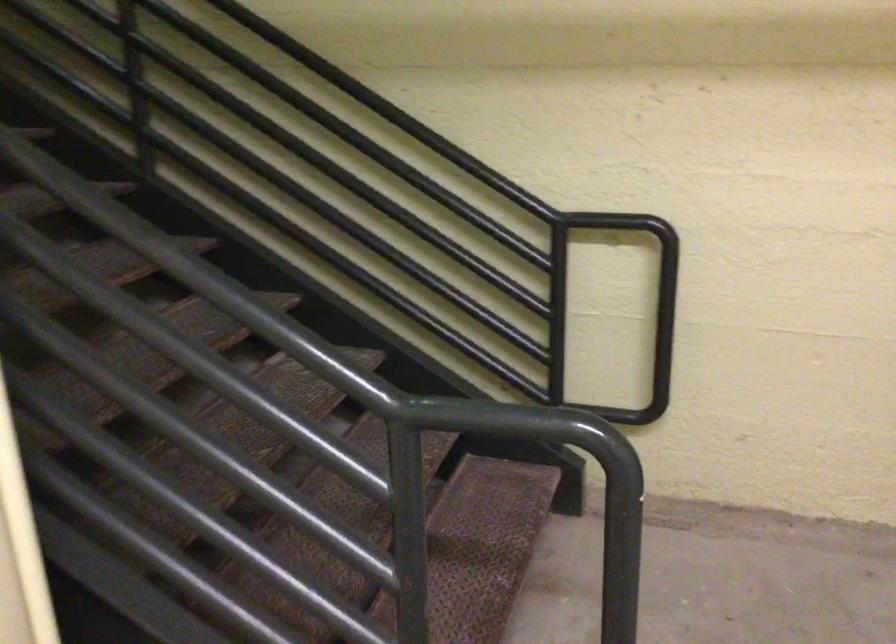
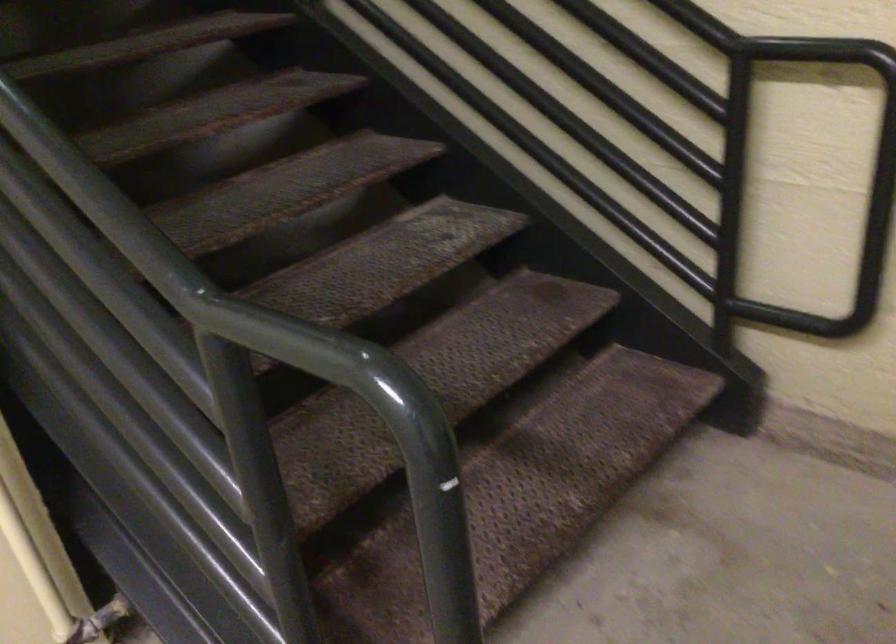
Which direction would the cameraman need to move to produce the second image?

The cameraman moved toward right, forward.